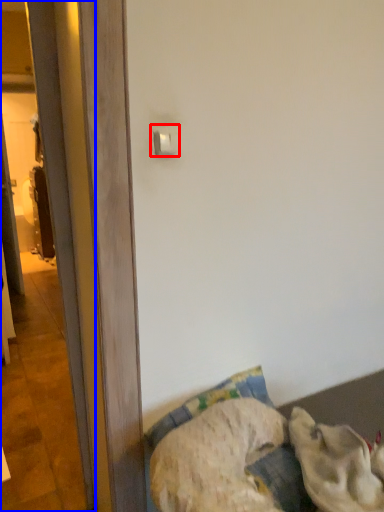
Question: Which point is further to the camera, light switch (highlighted by a red box) or screen door (highlighted by a blue box)?

Choices:
 (A) light switch
 (B) screen door

Answer: (A)